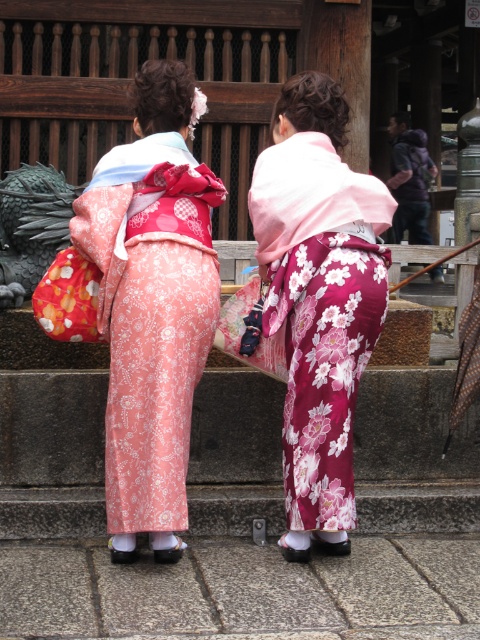
Which is in front, point (153, 388) or point (322, 488)?

Point (153, 388) is in front.

Does pink satin kimono at center lie in front of floral silk kimono at center?

Yes, pink satin kimono at center is closer to the viewer.

Is point (105, 253) farther from viewer compared to point (288, 536)?

No, (105, 253) is closer to viewer.

Image resolution: width=480 pixels, height=640 pixels. I want to click on pink satin kimono at center, so click(152, 304).